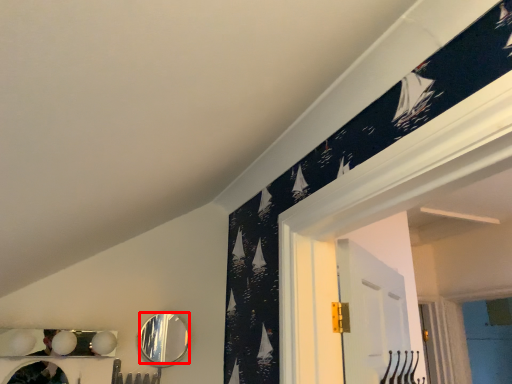
Question: In this image, where is mirror (annotated by the red box) located relative to mirror?

Choices:
 (A) right
 (B) left

Answer: (A)